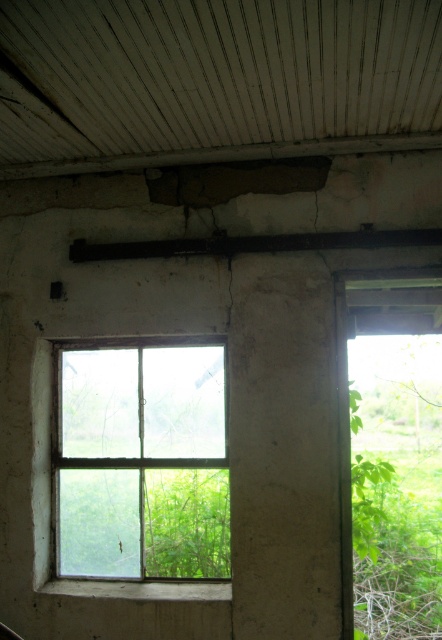
Between clear glass window at center and black metal beam at upper center, which one has less height?

black metal beam at upper center is shorter.

Measure the distance between clear glass window at center and camera.

clear glass window at center and camera are 11.71 feet apart.

This screenshot has height=640, width=442. What are the coordinates of `clear glass window at center` in the screenshot? It's located at (143, 460).